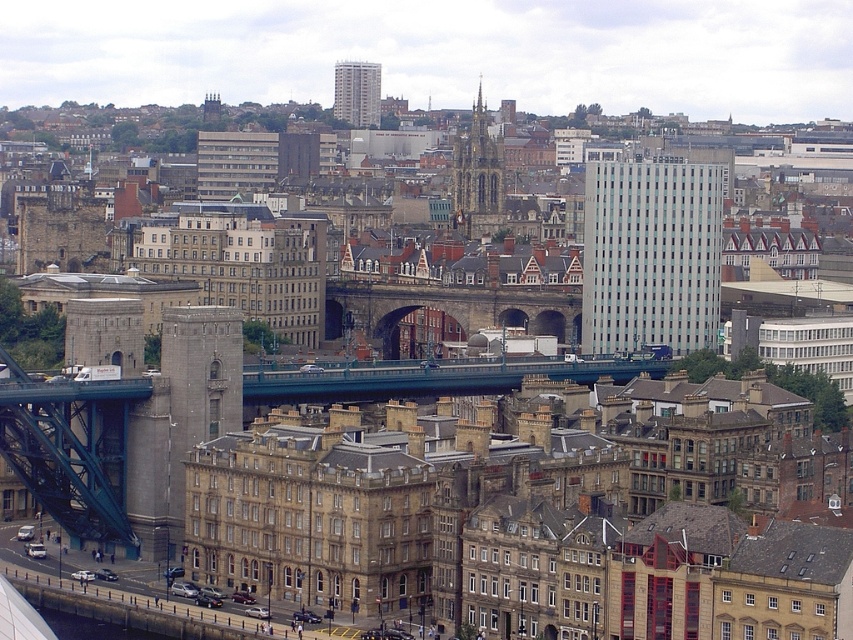
Is gray concrete building at center right wider than light gray concrete building at upper center?

Indeed, gray concrete building at center right has a greater width compared to light gray concrete building at upper center.

Can you confirm if gray concrete building at center right is shorter than light gray concrete building at upper center?

In fact, gray concrete building at center right may be taller than light gray concrete building at upper center.

Between point (668, 173) and point (340, 113), which one is positioned in front?

Positioned in front is point (668, 173).

Locate an element on the screen. Image resolution: width=853 pixels, height=640 pixels. gray concrete building at center right is located at coordinates (650, 256).

Can you confirm if blue metallic bridge at center is shorter than light gray concrete building at upper center?

Yes, blue metallic bridge at center is shorter than light gray concrete building at upper center.

Who is lower down, blue metallic bridge at center or light gray concrete building at upper center?

Positioned lower is blue metallic bridge at center.

Does point (345, 365) come in front of point (357, 106)?

Yes, it is.

Where is `blue metallic bridge at center`? blue metallic bridge at center is located at coordinates (428, 378).

Can you confirm if brown stone bridge at center is wider than dark gray stone tower at center?

Correct, the width of brown stone bridge at center exceeds that of dark gray stone tower at center.

Is brown stone bridge at center to the left of dark gray stone tower at center from the viewer's perspective?

Correct, you'll find brown stone bridge at center to the left of dark gray stone tower at center.

This screenshot has width=853, height=640. What do you see at coordinates (451, 308) in the screenshot?
I see `brown stone bridge at center` at bounding box center [451, 308].

What are the coordinates of `brown stone bridge at center` in the screenshot? It's located at (451, 308).